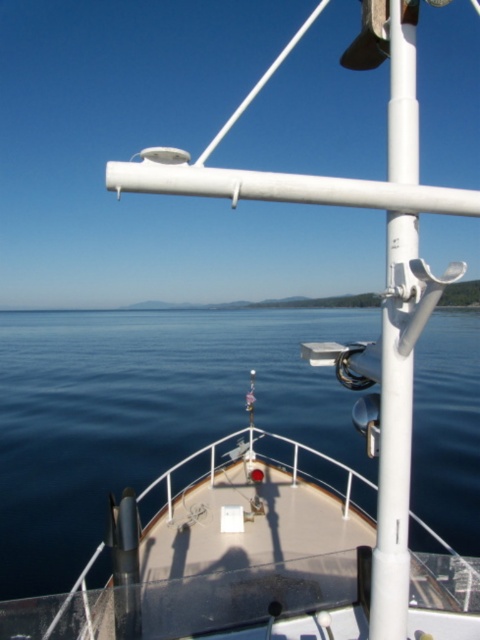
Question: Can you confirm if blue water at center is positioned to the left of white metallic pole at center-right?

Choices:
 (A) yes
 (B) no

Answer: (B)

Question: Considering the relative positions of blue water at center and white metallic pole at center-right in the image provided, where is blue water at center located with respect to white metallic pole at center-right?

Choices:
 (A) right
 (B) left

Answer: (A)

Question: Which point is farther from the camera taking this photo?

Choices:
 (A) (116, 419)
 (B) (379, 579)

Answer: (A)

Question: Observing the image, what is the correct spatial positioning of blue water at center in reference to white metallic pole at center-right?

Choices:
 (A) below
 (B) above

Answer: (A)

Question: Which object appears farthest from the camera in this image?

Choices:
 (A) blue water at center
 (B) white metallic pole at center-right

Answer: (A)

Question: Which point is closer to the camera?

Choices:
 (A) blue water at center
 (B) white metallic pole at center-right

Answer: (B)